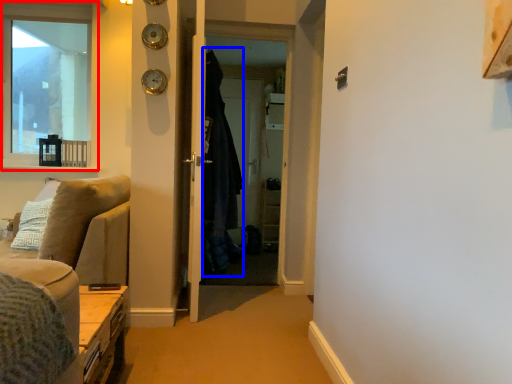
Question: Which object is further to the camera taking this photo, window (highlighted by a red box) or robe (highlighted by a blue box)?

Choices:
 (A) window
 (B) robe

Answer: (A)